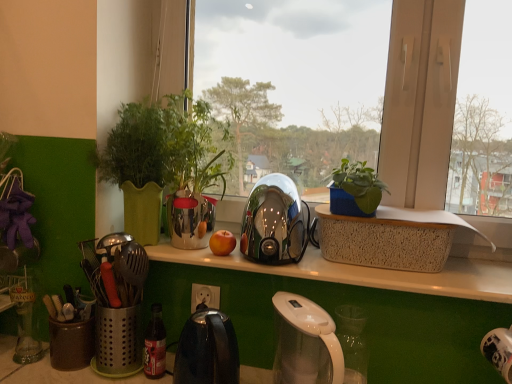
Question: From the image's perspective, does shiny metallic kettle at center, placed as the 1th kettle when sorted from top to bottom, appear lower than metallic silver kettle at center?

Choices:
 (A) yes
 (B) no

Answer: (A)

Question: Is shiny metallic kettle at center, placed as the 1th kettle when sorted from top to bottom, oriented towards metallic silver kettle at center?

Choices:
 (A) yes
 (B) no

Answer: (B)

Question: From the image's perspective, would you say shiny metallic kettle at center, placed as the 1th kettle when sorted from top to bottom, is positioned over metallic silver kettle at center?

Choices:
 (A) no
 (B) yes

Answer: (A)

Question: Is shiny metallic kettle at center, which is counted as the 2th kettle, starting from the bottom, taller than metallic silver kettle at center?

Choices:
 (A) no
 (B) yes

Answer: (A)

Question: Is shiny metallic kettle at center, placed as the 1th kettle when sorted from top to bottom, completely or partially outside of metallic silver kettle at center?

Choices:
 (A) yes
 (B) no

Answer: (A)

Question: In terms of height, does white translucent coffee maker at lower center look taller or shorter compared to green matte plant at left?

Choices:
 (A) short
 (B) tall

Answer: (A)

Question: In terms of width, does white translucent coffee maker at lower center look wider or thinner when compared to green matte plant at left?

Choices:
 (A) wide
 (B) thin

Answer: (A)

Question: Is white translucent coffee maker at lower center bigger or smaller than green matte plant at left?

Choices:
 (A) small
 (B) big

Answer: (A)

Question: In the image, is white translucent coffee maker at lower center on the left side or the right side of green matte plant at left?

Choices:
 (A) left
 (B) right

Answer: (B)

Question: Considering the relative positions of white glossy power outlet at center and shiny metallic kettle at center, which is counted as the 2th kettle, starting from the bottom, in the image provided, is white glossy power outlet at center to the left or to the right of shiny metallic kettle at center, which is counted as the 2th kettle, starting from the bottom,?

Choices:
 (A) right
 (B) left

Answer: (B)

Question: Choose the correct answer: Is white glossy power outlet at center inside shiny metallic kettle at center, which is counted as the 2th kettle, starting from the bottom, or outside it?

Choices:
 (A) outside
 (B) inside

Answer: (A)

Question: From a real-world perspective, relative to shiny metallic kettle at center, which is counted as the 2th kettle, starting from the bottom, is white glossy power outlet at center vertically above or below?

Choices:
 (A) below
 (B) above

Answer: (A)

Question: From their relative heights in the image, would you say white glossy power outlet at center is taller or shorter than shiny metallic kettle at center, which is counted as the 2th kettle, starting from the bottom?

Choices:
 (A) tall
 (B) short

Answer: (B)

Question: In terms of height, does metallic utensil holder at left look taller or shorter compared to matte plastic bottle at lower center?

Choices:
 (A) tall
 (B) short

Answer: (A)

Question: From a real-world perspective, is metallic utensil holder at left above or below matte plastic bottle at lower center?

Choices:
 (A) below
 (B) above

Answer: (B)